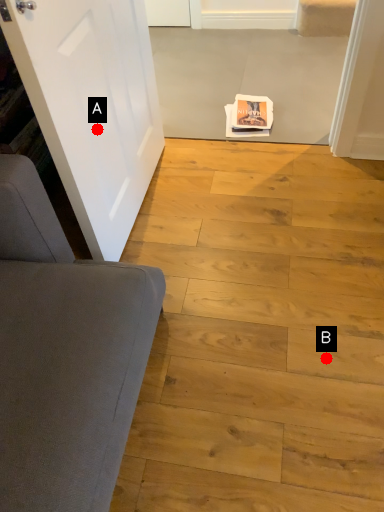
Question: Two points are circled on the image, labeled by A and B beside each circle. Which point is closer to the camera taking this photo?

Choices:
 (A) A is closer
 (B) B is closer

Answer: (A)